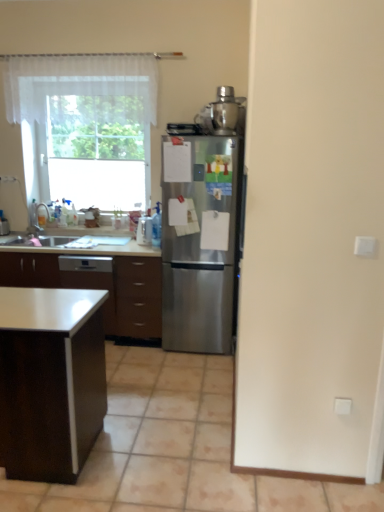
You are a GUI agent. You are given a task and a screenshot of the screen. Output one action in this format:
    pyautogui.click(x=<x>, y=<y>)
    Task: Click on the white glossy table at lower left
    The height and width of the screenshot is (512, 384).
    Given the screenshot: What is the action you would take?
    pyautogui.click(x=50, y=380)

I want to click on satin silver blender at upper right, marked as the 2th appliance in a back-to-front arrangement, so click(x=227, y=112).

At what (x,y) coordinates should I click in order to perform the action: click on brushed metal faucet at left. Please return your answer as a coordinate pair (x, y). Looking at the image, I should click on (42, 214).

From the image's perspective, between satin white dishwasher at lower left and white plastic electric outlet at lower right, who is located below?

white plastic electric outlet at lower right is shown below in the image.

From a real-world perspective, which is physically above, satin white dishwasher at lower left or white plastic electric outlet at lower right?

satin white dishwasher at lower left is physically above.

Considering the relative sizes of satin white dishwasher at lower left and white plastic electric outlet at lower right in the image provided, is satin white dishwasher at lower left smaller than white plastic electric outlet at lower right?

No.

Based on their positions, is satin white dishwasher at lower left located to the left or right of white plastic electric outlet at lower right?

satin white dishwasher at lower left is to the left of white plastic electric outlet at lower right.

From the picture: From the image's perspective, is white glossy table at lower left on brown wood drawer at center?

Incorrect, from the image's perspective, white glossy table at lower left is lower than brown wood drawer at center.

Relative to brown wood drawer at center, is white glossy table at lower left in front or behind?

Visually, white glossy table at lower left is located in front of brown wood drawer at center.

Which is more to the left, white glossy table at lower left or brown wood drawer at center?

From the viewer's perspective, white glossy table at lower left appears more on the left side.

In the scene shown: From a real-world perspective, which object rests below the other?

brown wood drawer at center, from a real-world perspective.

Considering the sizes of objects brushed metal faucet at left and white glossy table at lower left in the image provided, who is shorter, brushed metal faucet at left or white glossy table at lower left?

With less height is brushed metal faucet at left.

From the image's perspective, is brushed metal faucet at left over white glossy table at lower left?

Yes.

Is the position of brushed metal faucet at left more distant than that of white glossy table at lower left?

Yes, brushed metal faucet at left is behind white glossy table at lower left.

Can you confirm if brushed metal faucet at left is smaller than white glossy table at lower left?

Yes, brushed metal faucet at left is smaller than white glossy table at lower left.

Does point (40, 224) come in front of point (237, 112)?

No, (40, 224) is behind (237, 112).

Looking at the image, does brushed metal faucet at left seem bigger or smaller compared to satin silver blender at upper right, the 2th appliance from the left?

In the image, brushed metal faucet at left appears to be smaller than satin silver blender at upper right, the 2th appliance from the left.

From a real-world perspective, is brushed metal faucet at left positioned under satin silver blender at upper right, positioned as the first appliance in top-to-bottom order, based on gravity?

Indeed, from a real-world perspective, brushed metal faucet at left is positioned beneath satin silver blender at upper right, positioned as the first appliance in top-to-bottom order.

In terms of width, does brushed metal faucet at left look wider or thinner when compared to satin silver blender at upper right, marked as the 2th appliance in a back-to-front arrangement?

Considering their sizes, brushed metal faucet at left looks slimmer than satin silver blender at upper right, marked as the 2th appliance in a back-to-front arrangement.

Find the location of a particular element. This screenshot has width=384, height=512. table that is above the white plastic electric outlet at lower right (from the image's perspective) is located at coordinates (50, 380).

Does white plastic electric outlet at lower right lie behind white glossy table at lower left?

Yes, white plastic electric outlet at lower right is further from the camera.

From a real-world perspective, who is located higher, white plastic electric outlet at lower right or white glossy table at lower left?

white glossy table at lower left is physically above.

Does white plastic electric outlet at lower right contain white glossy table at lower left?

No, white glossy table at lower left is located outside of white plastic electric outlet at lower right.

What's the angular difference between stainless steel refrigerator at center and satin silver blender at upper right, positioned as the first appliance in top-to-bottom order,'s facing directions?

stainless steel refrigerator at center and satin silver blender at upper right, positioned as the first appliance in top-to-bottom order, are facing 0.000335 degrees away from each other.

Is stainless steel refrigerator at center to the right of satin silver blender at upper right, positioned as the first appliance in top-to-bottom order, from the viewer's perspective?

No.

Would you say stainless steel refrigerator at center is outside satin silver blender at upper right, the 2th appliance from the left?

stainless steel refrigerator at center lies outside satin silver blender at upper right, the 2th appliance from the left,'s area.

Is there a large distance between stainless steel refrigerator at center and satin silver blender at upper right, marked as the 2th appliance in a back-to-front arrangement?

They are positioned close to each other.

Considering the sizes of white glossy table at lower left and white plastic electric outlet at lower right in the image, is white glossy table at lower left bigger or smaller than white plastic electric outlet at lower right?

white glossy table at lower left is bigger than white plastic electric outlet at lower right.

Between white glossy table at lower left and white plastic electric outlet at lower right, which one has less height?

white plastic electric outlet at lower right.

In the scene shown: From a real-world perspective, who is located higher, white glossy table at lower left or white plastic electric outlet at lower right?

white glossy table at lower left, from a real-world perspective.

Based on the photo, can you confirm if white glossy table at lower left is positioned to the right of white plastic electric outlet at lower right?

No.

The image size is (384, 512). Find the location of `electric outlet lying below the satin white dishwasher at lower left (from the image's perspective)`. electric outlet lying below the satin white dishwasher at lower left (from the image's perspective) is located at coordinates (342, 406).

Identify the location of drawer beneath the white glossy table at lower left (from a real-world perspective). (138, 297).

In the scene shown: Based on their spatial positions, is stainless steel refrigerator at center or brown wood drawer at center closer to brushed metal faucet at left?

The object closer to brushed metal faucet at left is brown wood drawer at center.

Estimate the real-world distances between objects in this image. Which object is further from white glossy table at lower left, satin silver blender at upper right, arranged as the second appliance when ordered from the bottom, or stainless steel refrigerator at center?

The object further to white glossy table at lower left is satin silver blender at upper right, arranged as the second appliance when ordered from the bottom.

Looking at the image, which one is located further to brown wood drawer at center, clear plastic spray bottle at center, which ranks as the 2th appliance in right-to-left order, or satin white dishwasher at lower left?

The object further to brown wood drawer at center is clear plastic spray bottle at center, which ranks as the 2th appliance in right-to-left order.

Considering their positions, is brushed metal faucet at left positioned closer to stainless steel refrigerator at center than white plastic electric outlet at lower right?

white plastic electric outlet at lower right is positioned closer to the anchor stainless steel refrigerator at center.

Estimate the real-world distances between objects in this image. Which object is further from clear plastic spray bottle at center, which ranks as the 2th appliance in right-to-left order, satin silver blender at upper right, arranged as the second appliance when ordered from the bottom, or white sheer curtain at upper left?

white sheer curtain at upper left is further to clear plastic spray bottle at center, which ranks as the 2th appliance in right-to-left order.

From the image, which object appears to be farther from brown wood drawer at center, satin silver blender at upper right, the 2th appliance from the left, or white sheer curtain at upper left?

The object further to brown wood drawer at center is white sheer curtain at upper left.

Looking at the image, which one is located closer to satin white dishwasher at lower left, clear plastic spray bottle at center, the 1th appliance in the left-to-right sequence, or satin silver blender at upper right, the 2th appliance from the left?

clear plastic spray bottle at center, the 1th appliance in the left-to-right sequence.

From the image, which object appears to be farther from satin white dishwasher at lower left, clear plastic spray bottle at center, which is counted as the first appliance, starting from the bottom, or brown wood drawer at center?

Based on the image, clear plastic spray bottle at center, which is counted as the first appliance, starting from the bottom, appears to be further to satin white dishwasher at lower left.

Where is `table between satin silver blender at upper right, arranged as the second appliance when ordered from the bottom, and white plastic electric outlet at lower right from top to bottom`? table between satin silver blender at upper right, arranged as the second appliance when ordered from the bottom, and white plastic electric outlet at lower right from top to bottom is located at coordinates pyautogui.click(x=50, y=380).

Locate an element on the screen. This screenshot has height=512, width=384. drawer located between brushed metal faucet at left and white plastic electric outlet at lower right in the left-right direction is located at coordinates (138, 297).

In order to click on electric outlet positioned between white glossy table at lower left and brushed metal faucet at left from near to far in this screenshot , I will do `click(342, 406)`.

The width and height of the screenshot is (384, 512). What are the coordinates of `drawer between white sheer curtain at upper left and white glossy table at lower left in the vertical direction` in the screenshot? It's located at (138, 297).